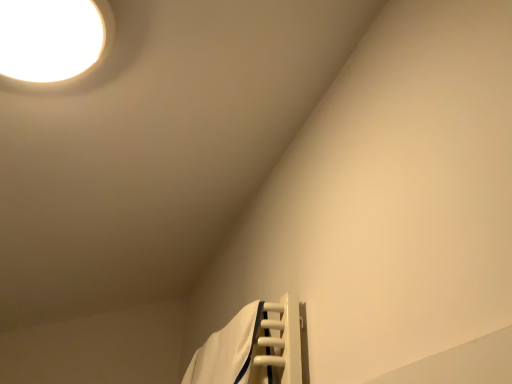
Question: Considering the positions of white glossy light fixture at upper left and white fabric bath towel at lower right in the image, is white glossy light fixture at upper left bigger or smaller than white fabric bath towel at lower right?

Choices:
 (A) small
 (B) big

Answer: (B)

Question: Considering their positions, is white glossy light fixture at upper left located in front of or behind white fabric bath towel at lower right?

Choices:
 (A) front
 (B) behind

Answer: (A)

Question: Is white glossy light fixture at upper left wider or thinner than white fabric bath towel at lower right?

Choices:
 (A) wide
 (B) thin

Answer: (A)

Question: From the image's perspective, is white fabric bath towel at lower right positioned above or below white glossy light fixture at upper left?

Choices:
 (A) above
 (B) below

Answer: (B)

Question: Looking at their shapes, would you say white fabric bath towel at lower right is wider or thinner than white glossy light fixture at upper left?

Choices:
 (A) thin
 (B) wide

Answer: (A)

Question: Considering the relative positions of white fabric bath towel at lower right and white glossy light fixture at upper left in the image provided, is white fabric bath towel at lower right to the left or to the right of white glossy light fixture at upper left?

Choices:
 (A) right
 (B) left

Answer: (A)

Question: In terms of height, does white fabric bath towel at lower right look taller or shorter compared to white glossy light fixture at upper left?

Choices:
 (A) short
 (B) tall

Answer: (B)